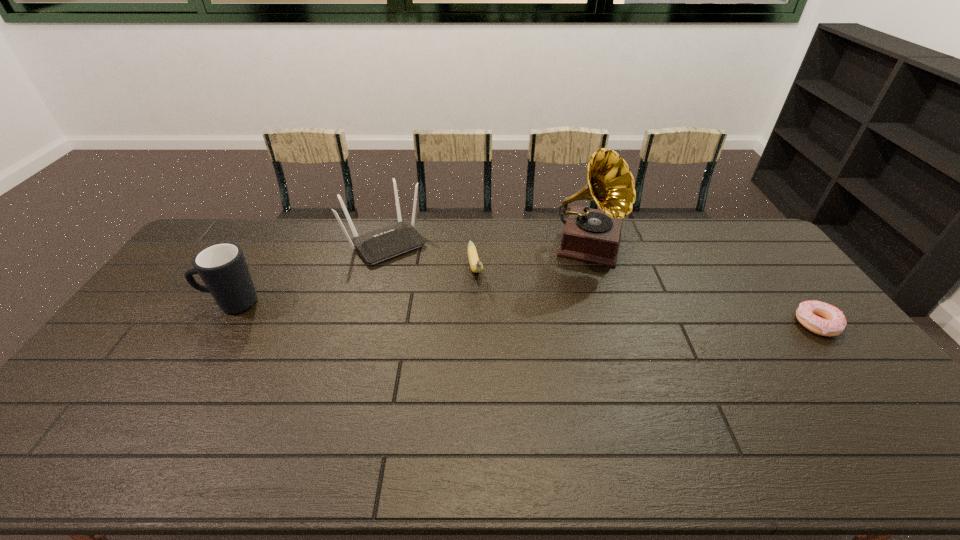
Find the location of a particular element. the leftmost object is located at coordinates (222, 267).

Locate an element on the screen. The height and width of the screenshot is (540, 960). doughnut is located at coordinates (821, 318).

The image size is (960, 540). Identify the location of the rightmost object. pyautogui.click(x=821, y=318).

What are the coordinates of `the second shortest object` in the screenshot? It's located at (476, 265).

You are a GUI agent. You are given a task and a screenshot of the screen. Output one action in this format:
    pyautogui.click(x=<x>, y=<y>)
    Task: Click on the third object from right to left
    The image size is (960, 540).
    Given the screenshot: What is the action you would take?
    pyautogui.click(x=476, y=265)

You are a GUI agent. You are given a task and a screenshot of the screen. Output one action in this format:
    pyautogui.click(x=<x>, y=<y>)
    Task: Click on the second object from left to right
    The width and height of the screenshot is (960, 540).
    Given the screenshot: What is the action you would take?
    pyautogui.click(x=376, y=246)

Locate an element on the screen. Image resolution: width=960 pixels, height=540 pixels. the fourth object from left to right is located at coordinates (592, 235).

You are a GUI agent. You are given a task and a screenshot of the screen. Output one action in this format:
    pyautogui.click(x=<x>, y=<y>)
    Task: Click on the tallest object
    
    Given the screenshot: What is the action you would take?
    click(592, 235)

The height and width of the screenshot is (540, 960). I want to click on free location located 0.120m on the front of the rightmost object, so [855, 374].

Where is `free location located 0.160m at the stem of the third object from right to left`? The height and width of the screenshot is (540, 960). free location located 0.160m at the stem of the third object from right to left is located at coordinates (486, 322).